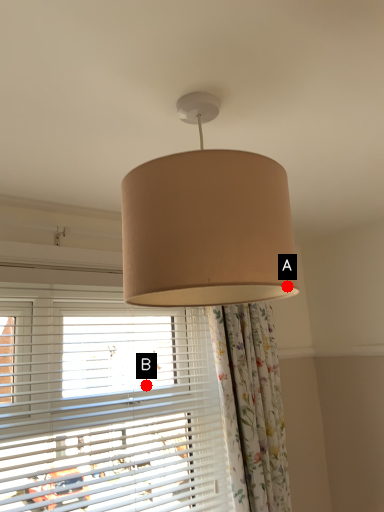
Question: Two points are circled on the image, labeled by A and B beside each circle. Among these points, which one is nearest to the camera?

Choices:
 (A) A is closer
 (B) B is closer

Answer: (A)